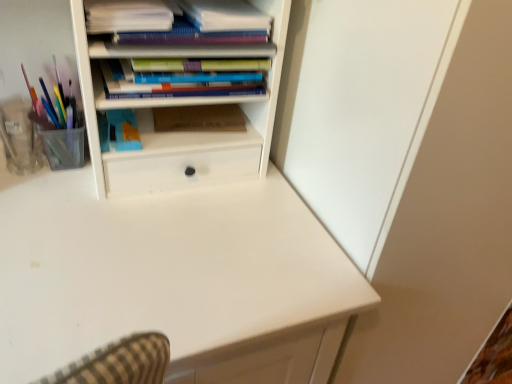
Question: In terms of width, does matte purple notebook at upper center, the 2th book positioned from the top, look wider or thinner when compared to blue matte paperback book at center, the 1th paperback book viewed from the left?

Choices:
 (A) wide
 (B) thin

Answer: (A)

Question: Relative to blue matte paperback book at center, the 1th paperback book viewed from the left, is matte purple notebook at upper center, the 2th book positioned from the top, in front or behind?

Choices:
 (A) front
 (B) behind

Answer: (A)

Question: Estimate the real-world distances between objects in this image. Which object is farther from the blue matte paperback book at center, the 1th paperback book viewed from the left?

Choices:
 (A) matte purple notebook at upper center, the 2th book positioned from the top
 (B) brown cardboard at center, the 1th paperback book viewed from the right
 (C) white paper stack at upper left, acting as the first book starting from the top
 (D) white matte desk at center
 (E) hardcover books at upper center, the first book positioned from the bottom

Answer: (D)

Question: Which object is positioned closest to the brown cardboard at center, placed as the 2th paperback book when sorted from left to right?

Choices:
 (A) white paper stack at upper left, the third book positioned from the bottom
 (B) white matte desk at center
 (C) blue matte paperback book at center, the 1th paperback book viewed from the left
 (D) hardcover books at upper center, the third book from the top
 (E) matte purple notebook at upper center, the 2th book positioned from the top

Answer: (C)